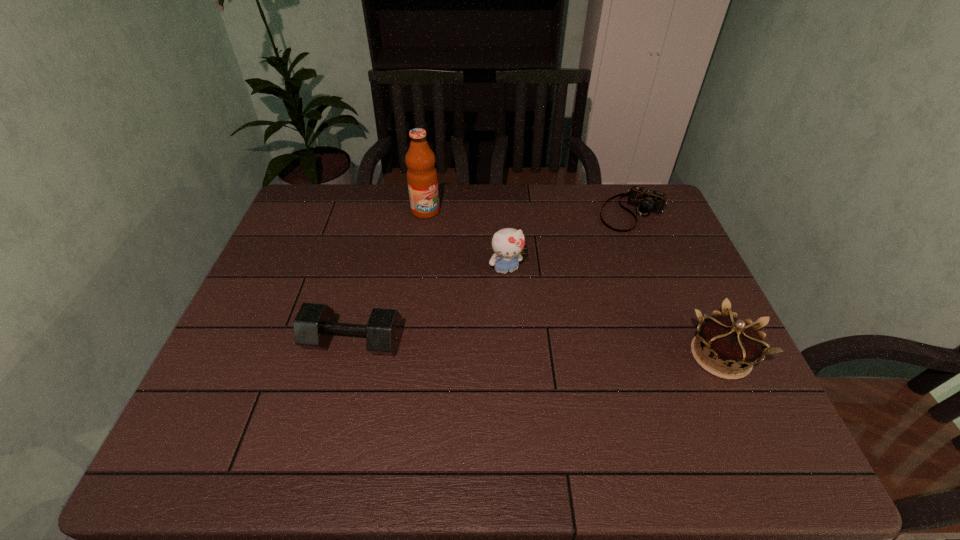
The width and height of the screenshot is (960, 540). Find the location of `dumbbell`. dumbbell is located at coordinates (314, 325).

Where is `crown`? The height and width of the screenshot is (540, 960). crown is located at coordinates (726, 341).

At what (x,y) coordinates should I click in order to perform the action: click on camera. Please return your answer as a coordinate pair (x, y). This screenshot has height=540, width=960. Looking at the image, I should click on (645, 200).

Where is `the third object from right to left`? The image size is (960, 540). the third object from right to left is located at coordinates (508, 243).

Identify the location of kitten. pyautogui.click(x=508, y=243).

Locate an element on the screen. Image resolution: width=960 pixels, height=540 pixels. fruit juice is located at coordinates (422, 179).

The width and height of the screenshot is (960, 540). In order to click on vacant space located 0.270m on the right of the fourth tallest object in this screenshot , I will do `click(513, 342)`.

This screenshot has height=540, width=960. Find the location of `free space located 0.270m on the back of the third shortest object`. free space located 0.270m on the back of the third shortest object is located at coordinates (673, 253).

Identify the location of free space located on the front-facing side of the camera. (606, 248).

This screenshot has height=540, width=960. In order to click on vacant space located on the front-facing side of the camera in this screenshot , I will do `click(567, 301)`.